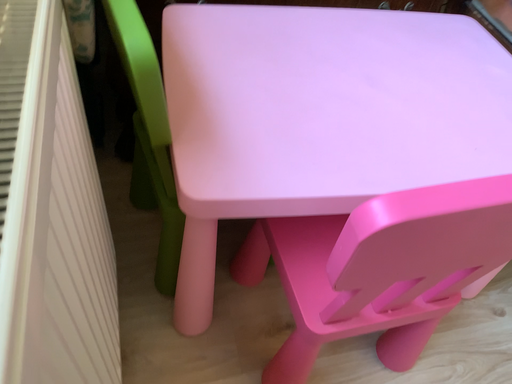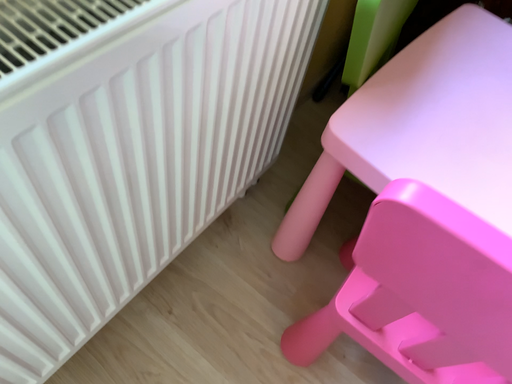
Question: How did the camera likely rotate when shooting the video?

Choices:
 (A) rotated left
 (B) rotated right

Answer: (A)